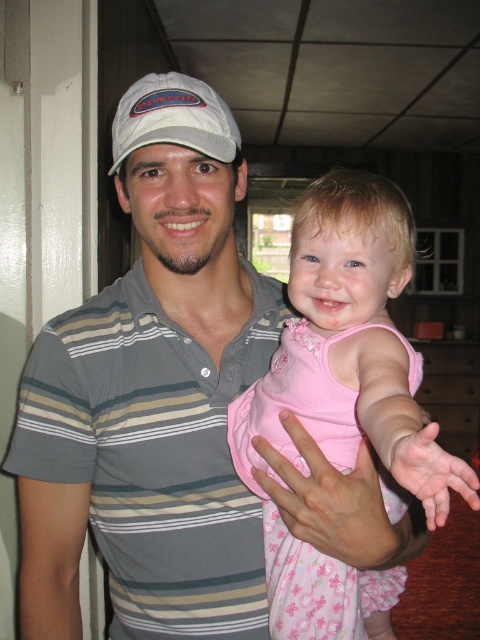
You are a fashion designer observing two shirts in the image. The striped cotton polo shirt at center and the gray striped shirt at left. Which shirt has a greater width?

The striped cotton polo shirt at center has a greater width than the gray striped shirt at left.

You are a photographer setting up for a family photo shoot. You need to position the pink satin dress at center and the gray striped shirt at left so that both subjects are visible in the frame. Based on their heights, which subject should you adjust the camera angle to focus on first?

The pink satin dress at center is taller than the gray striped shirt at left, so you should adjust the camera angle to focus on the pink satin dress at center first to ensure both subjects are visible.

You are a photographer trying to capture a clear image of both the striped cotton polo shirt at center and the gray striped shirt at left. Which one should you focus on first to ensure both are in focus?

The striped cotton polo shirt at center is closer to the viewer than the gray striped shirt at left. To ensure both are in focus, you should focus on the gray striped shirt at left first, as it is farther away, and adjust the depth of field accordingly.